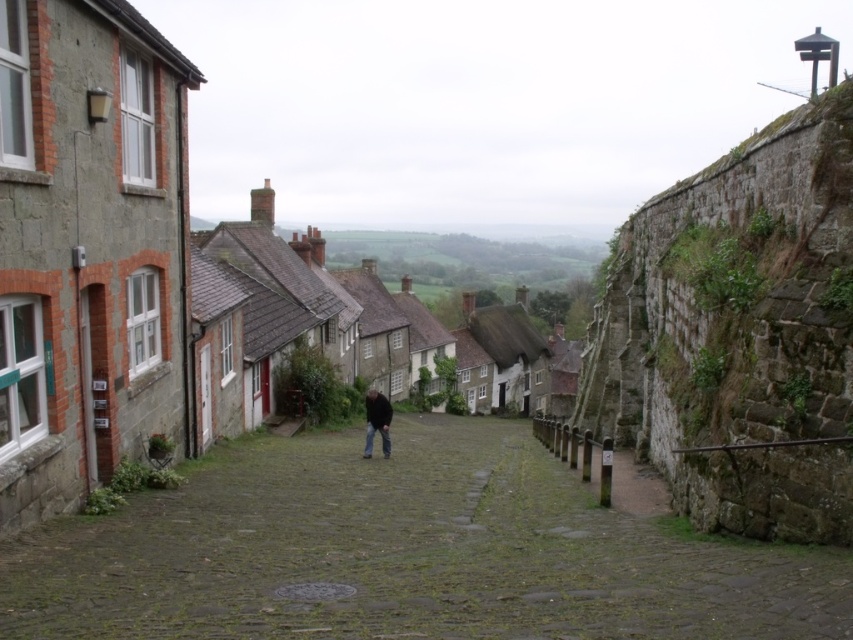
Question: Can you confirm if stone paved alley at center is positioned to the left of matte stone village at center?

Choices:
 (A) no
 (B) yes

Answer: (A)

Question: Which of these objects is positioned closest to the stone paved alley at center?

Choices:
 (A) matte stone village at center
 (B) dark brown leather jacket at center
 (C) rustic stone wall at right

Answer: (B)

Question: Which object is closer to the camera taking this photo?

Choices:
 (A) dark brown leather jacket at center
 (B) matte stone village at center
 (C) rustic stone wall at right

Answer: (C)

Question: Which point is closer to the camera?

Choices:
 (A) (328, 282)
 (B) (758, 358)
 (C) (376, 404)

Answer: (B)

Question: Can you confirm if stone paved alley at center is positioned below matte stone village at center?

Choices:
 (A) no
 (B) yes

Answer: (B)

Question: Can you confirm if stone paved alley at center is positioned to the right of dark brown leather jacket at center?

Choices:
 (A) yes
 (B) no

Answer: (A)